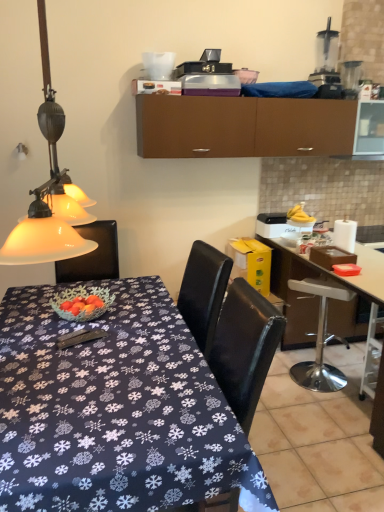
Question: Is white plastic chair at right bigger or smaller than brown matte cabinet at upper center?

Choices:
 (A) small
 (B) big

Answer: (A)

Question: Considering the positions of white plastic chair at right and brown matte cabinet at upper center in the image, is white plastic chair at right wider or thinner than brown matte cabinet at upper center?

Choices:
 (A) wide
 (B) thin

Answer: (B)

Question: Which of these objects is positioned farthest from the brown matte cabinet at upper center?

Choices:
 (A) metallic silver bar stool at lower right
 (B) white plastic chair at right
 (C) transparent plastic blender at upper right, the 2th appliance from the right
 (D) transparent plastic blender at upper right, arranged as the first appliance when viewed from the right
 (E) white glossy desk at right, arranged as the 1th desk when viewed from the right

Answer: (A)

Question: Based on their relative distances, which object is nearer to the metallic silver bar stool at lower right?

Choices:
 (A) transparent plastic blender at upper right, arranged as the first appliance when viewed from the left
 (B) brown matte cabinet at upper center
 (C) transparent plastic blender at upper right, arranged as the first appliance when viewed from the right
 (D) white plastic chair at right
 (E) matte glass lampshade at left

Answer: (D)